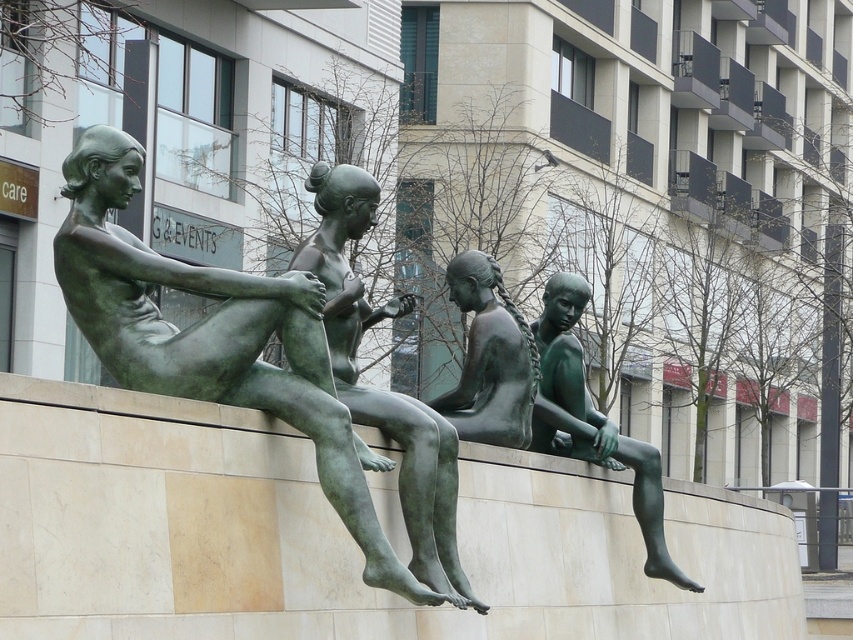
Based on the photo, you are a maintenance worker who needs to move a 6 feet long ladder from the green polished bronze girl at lower right to the green patina statue at center. Can you move the ladder horizontally between them without tilting it?

The distance between the green polished bronze girl at lower right and the green patina statue at center is 5.46 feet, which is shorter than the ladder length of 6 feet. Therefore, the ladder cannot be moved horizontally between them without tilting.

You are standing in front of a group of bronze sculptures on a curved stone bench. You notice a specific point marked at coordinates point (199,372). If you want to reach that point without moving closer than 25 meters from where you are now, can you do it?

The point (199,372) is 26.11 meters away from the camera. Since you want to stay at least 25 meters away, you cannot reach it without moving closer than 25 meters.

You are an art curator planning to display both the green bronze statue at center and the green patina statue at center in an exhibition. Based on their sizes, which statue should be placed on the taller pedestal to ensure proper visual balance?

The green bronze statue at center is larger in size than the green patina statue at center, so the larger green bronze statue at center should be placed on the taller pedestal to maintain visual balance between the two statues.